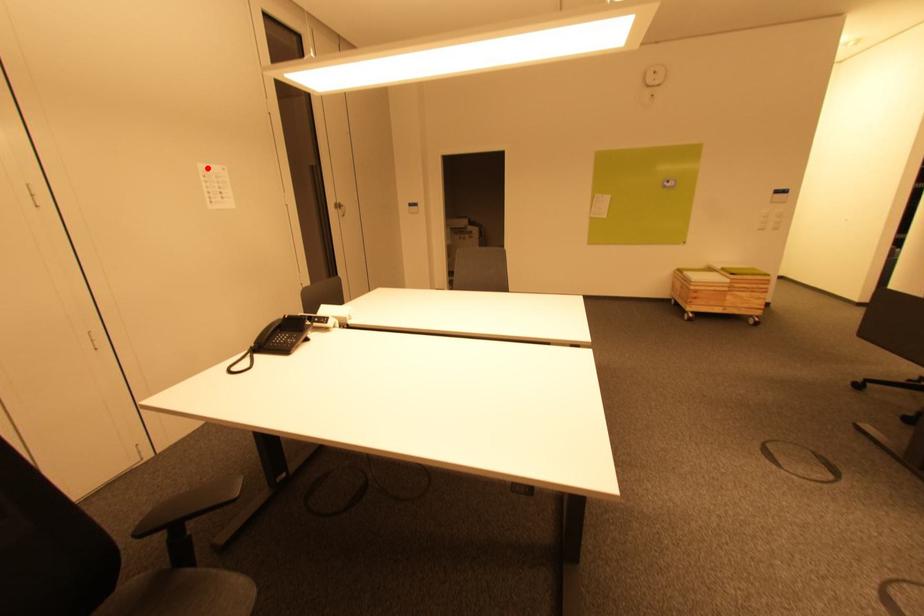
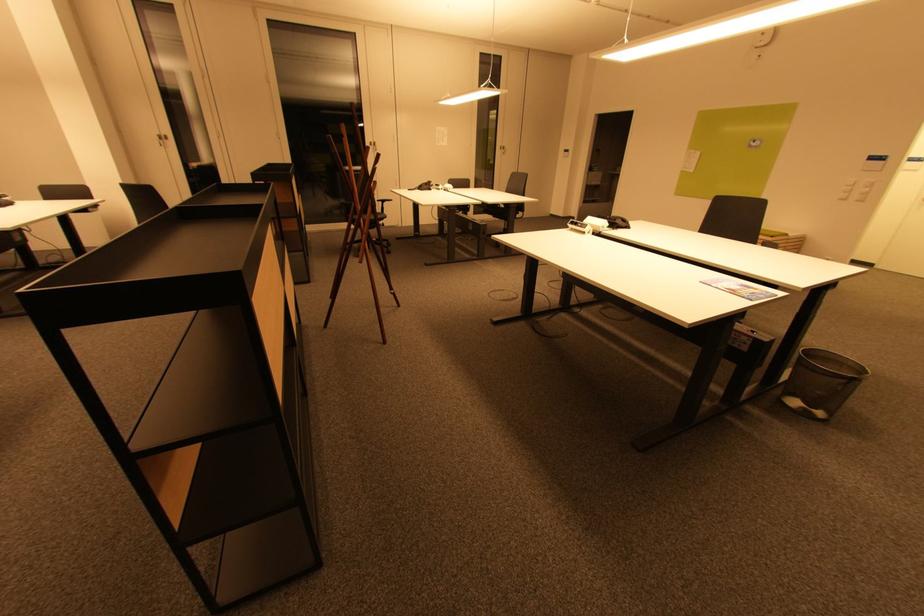
Question: I am providing you with two images of the same scene from different viewpoints. A red point is shown in image1. For the corresponding object point in image2, is it positioned nearer or farther from the camera?

Choices:
 (A) Nearer
 (B) Farther

Answer: (A)